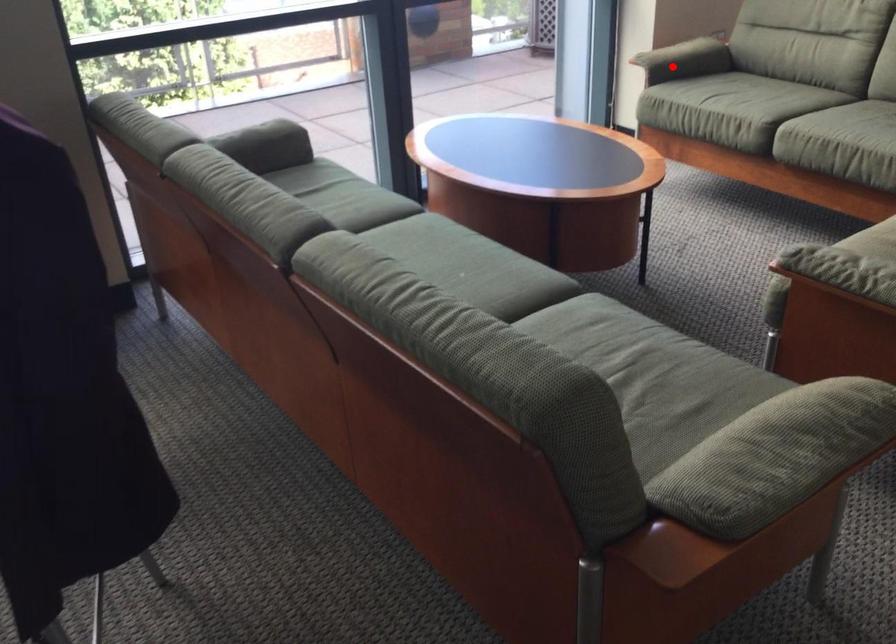
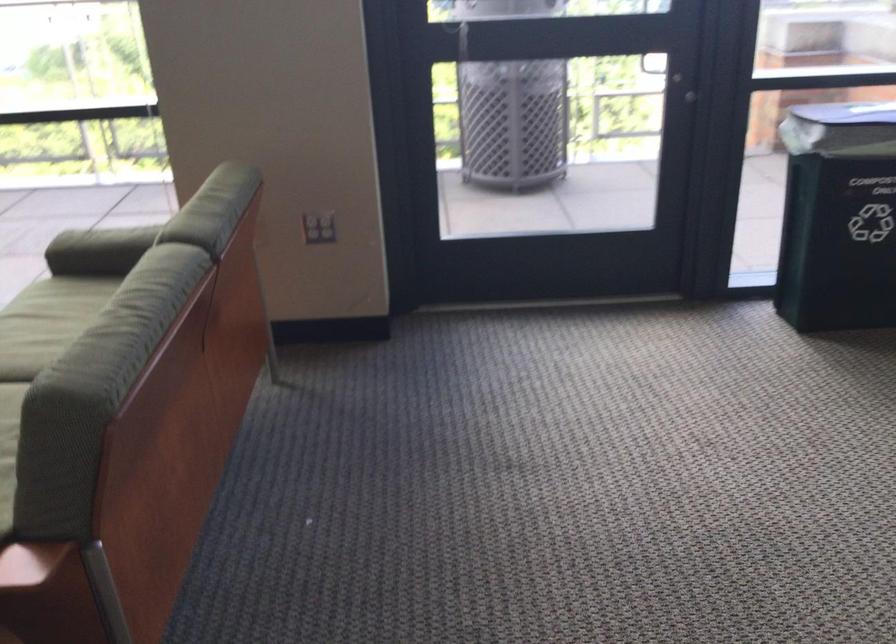
In the second image, find the point that corresponds to the highlighted location in the first image.

(99, 247)